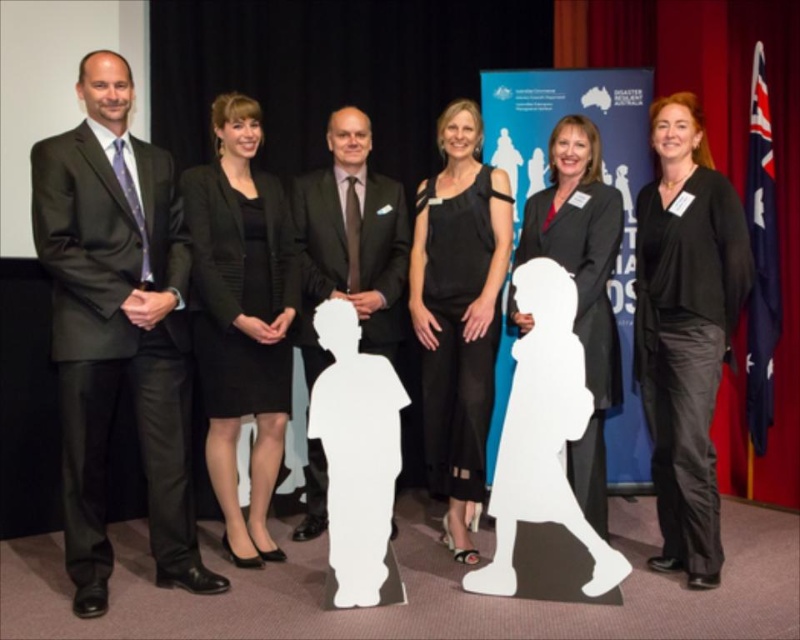
Is point (498, 256) farther from camera compared to point (582, 188)?

Yes, it is behind point (582, 188).

Image resolution: width=800 pixels, height=640 pixels. I want to click on black satin dress at center, so click(x=458, y=314).

Where is `black satin dress at center`? The width and height of the screenshot is (800, 640). black satin dress at center is located at coordinates (458, 314).

Which is behind, point (106, 557) or point (532, 220)?

The point (532, 220) is behind.

Is point (90, 224) behind point (537, 209)?

That is False.

Locate an element on the screen. The image size is (800, 640). matte black suit at left is located at coordinates (117, 328).

This screenshot has height=640, width=800. What do you see at coordinates (686, 328) in the screenshot?
I see `black satin blouse at right` at bounding box center [686, 328].

Does black satin blouse at right appear on the left side of black textured blazer at center?

In fact, black satin blouse at right is to the right of black textured blazer at center.

Between point (698, 436) and point (248, 209), which one is positioned behind?

Point (248, 209)

The image size is (800, 640). Identify the location of black satin blouse at right. (686, 328).